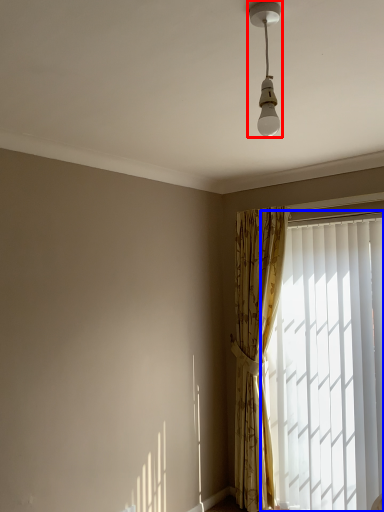
Question: Which of the following is the farthest to the observer, lamp (highlighted by a red box) or window (highlighted by a blue box)?

Choices:
 (A) lamp
 (B) window

Answer: (B)